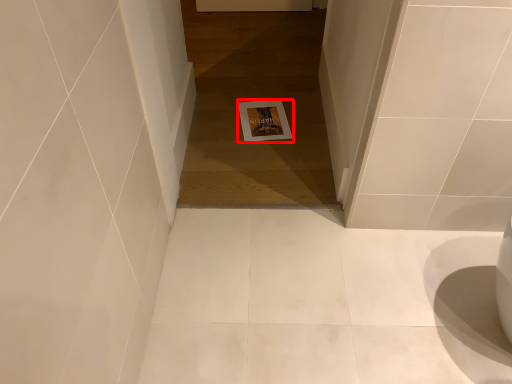
Question: From the image's perspective, what is the correct spatial relationship of postcard (annotated by the red box) in relation to passage?

Choices:
 (A) below
 (B) above

Answer: (A)